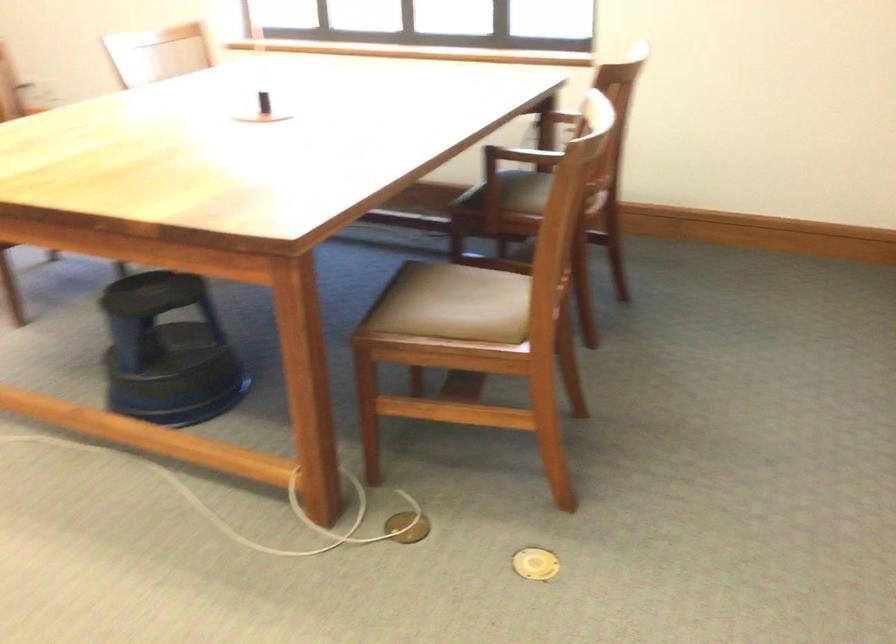
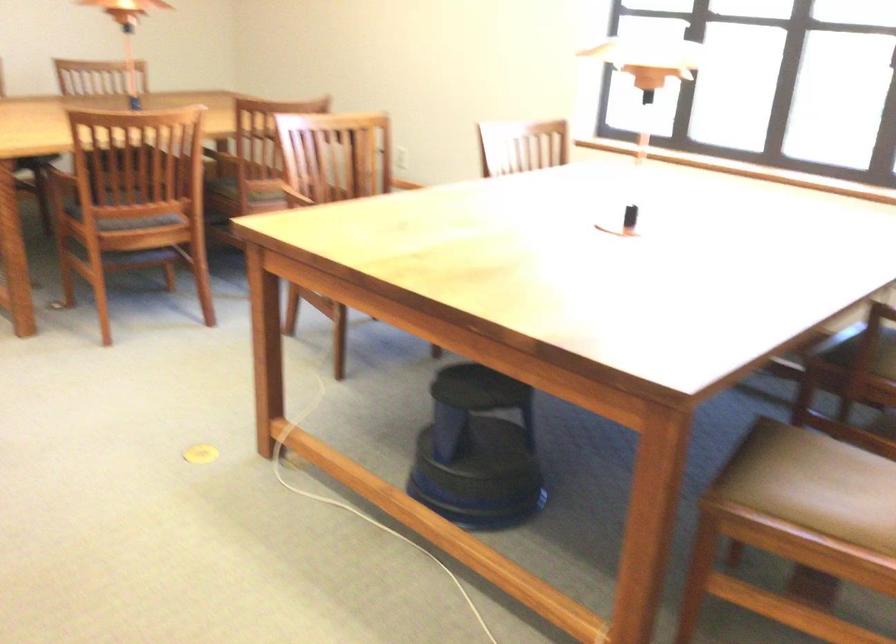
The point at (x=453, y=299) is marked in the first image. Where is the corresponding point in the second image?

(824, 478)